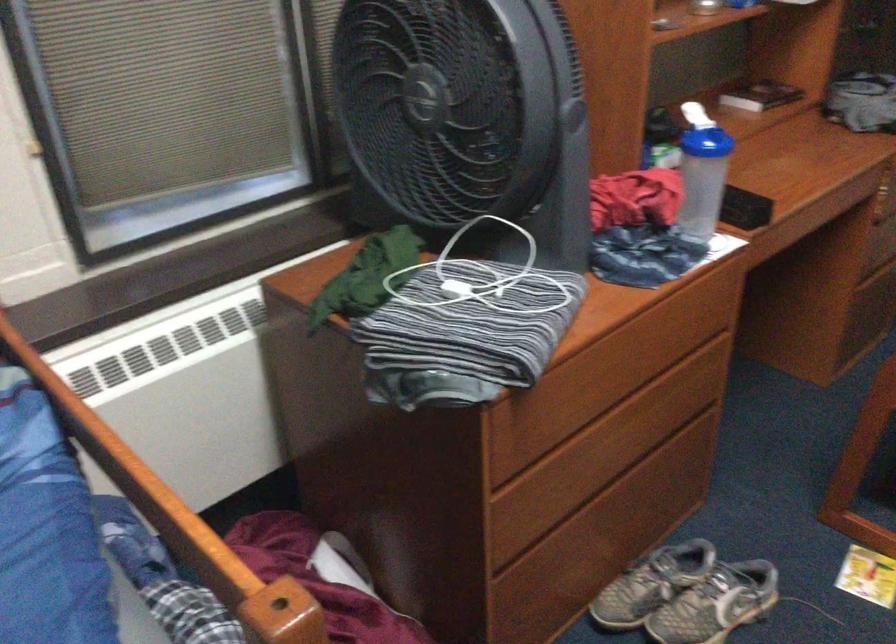
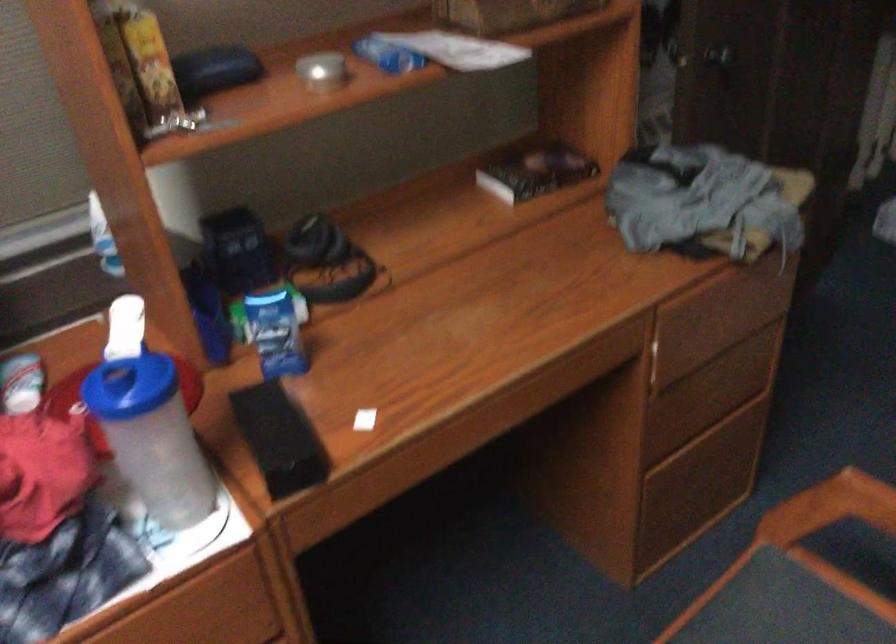
Find the pixel in the second image that matches (x=719, y=175) in the first image.

(151, 437)